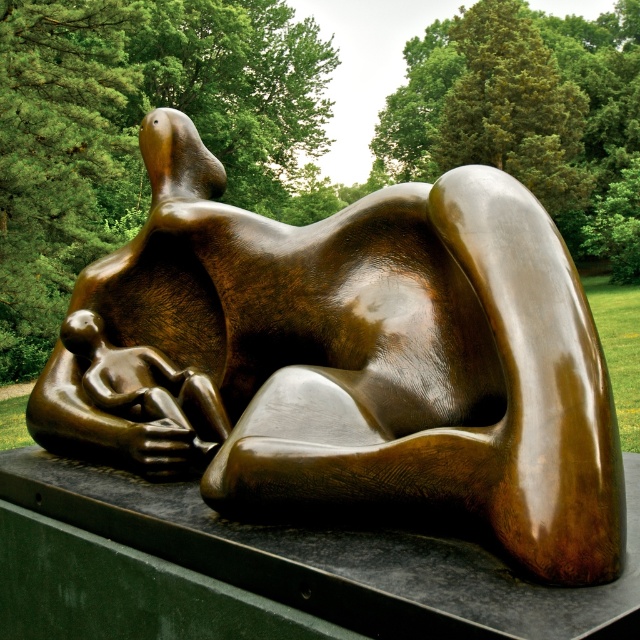
Question: Does bronze sculpture at center appear under matte bronze baby at lower left?

Choices:
 (A) yes
 (B) no

Answer: (B)

Question: Does bronze sculpture at center come in front of matte bronze baby at lower left?

Choices:
 (A) yes
 (B) no

Answer: (A)

Question: Which point is farther to the camera?

Choices:
 (A) (172, 404)
 (B) (369, 396)

Answer: (A)

Question: Can you confirm if bronze sculpture at center is positioned to the right of matte bronze baby at lower left?

Choices:
 (A) yes
 (B) no

Answer: (A)

Question: Which object is closer to the camera taking this photo?

Choices:
 (A) bronze sculpture at center
 (B) matte bronze baby at lower left

Answer: (A)

Question: Which point is closer to the camera taking this photo?

Choices:
 (A) (428, 342)
 (B) (92, 340)

Answer: (A)